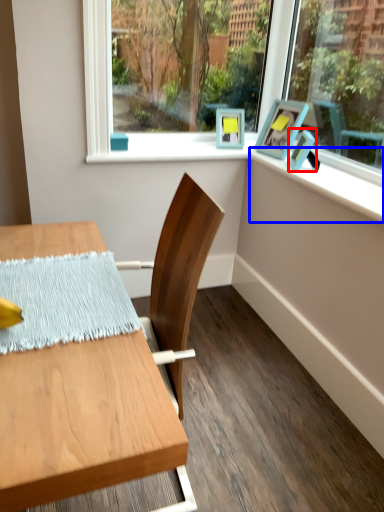
Question: Which object is closer to the camera taking this photo, picture frame (highlighted by a red box) or window sill (highlighted by a blue box)?

Choices:
 (A) picture frame
 (B) window sill

Answer: (B)